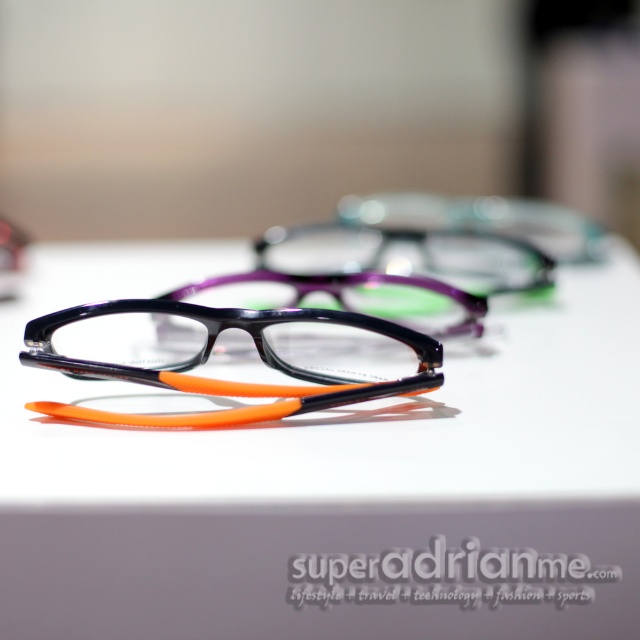
Who is shorter, matte purple glasses at center or translucent orange plastic glasses at center?

Standing shorter between the two is translucent orange plastic glasses at center.

Locate an element on the screen. This screenshot has height=640, width=640. matte purple glasses at center is located at coordinates (406, 253).

Can you confirm if white plastic glasses at center is smaller than matte purple glasses at center?

Actually, white plastic glasses at center might be larger than matte purple glasses at center.

Looking at this image, does white plastic glasses at center appear over matte purple glasses at center?

No, white plastic glasses at center is not above matte purple glasses at center.

In order to click on white plastic glasses at center in this screenshot , I will do `click(332, 481)`.

Can you confirm if white plastic glasses at center is taller than translucent orange plastic glasses at center?

Correct, white plastic glasses at center is much taller as translucent orange plastic glasses at center.

Looking at this image, who is more forward, (381, 538) or (296, 305)?

Positioned in front is point (381, 538).

The image size is (640, 640). Find the location of `white plastic glasses at center`. white plastic glasses at center is located at coordinates (332, 481).